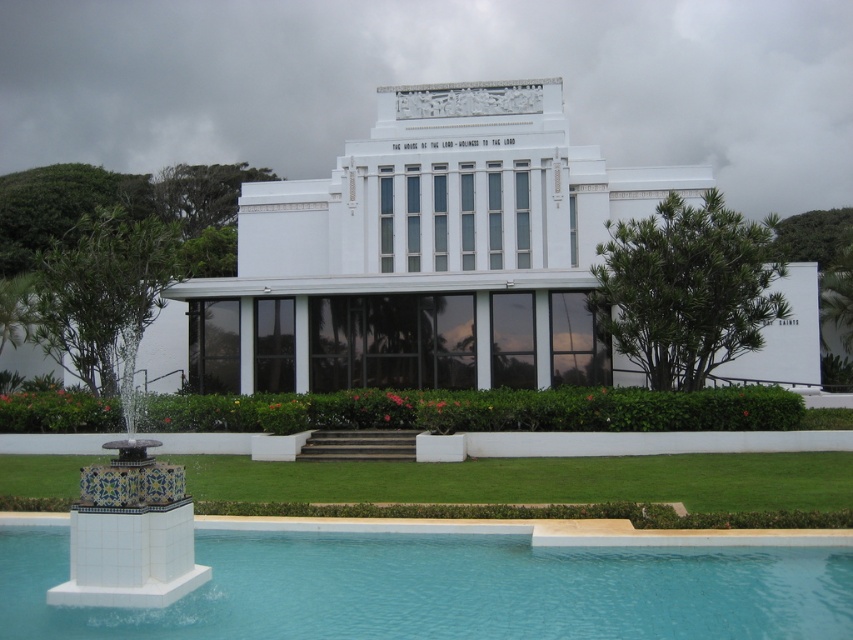
Question: Estimate the real-world distances between objects in this image. Which object is closer to the green leafy tree at right?

Choices:
 (A) blue glossy water at lower center
 (B) green leafy tree at left
 (C) blue tile fountain at lower left
 (D) green grass at lower center

Answer: (D)

Question: Can you confirm if green grass at lower center is wider than green leafy tree at left?

Choices:
 (A) yes
 (B) no

Answer: (B)

Question: Which point is farther from the camera taking this photo?

Choices:
 (A) (759, 480)
 (B) (418, 595)

Answer: (A)

Question: Which point appears closest to the camera in this image?

Choices:
 (A) (112, 330)
 (B) (84, 516)
 (C) (39, 240)

Answer: (B)

Question: From the image, what is the correct spatial relationship of green grass at lower center in relation to green leafy tree at left?

Choices:
 (A) left
 (B) right

Answer: (B)

Question: Is blue tile fountain at lower left wider than green leafy tree at upper left?

Choices:
 (A) no
 (B) yes

Answer: (B)